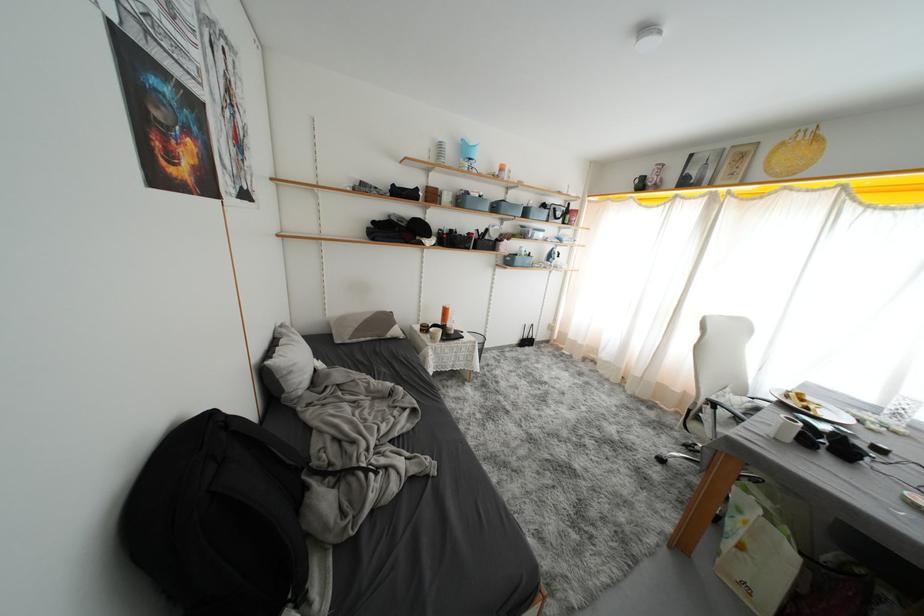
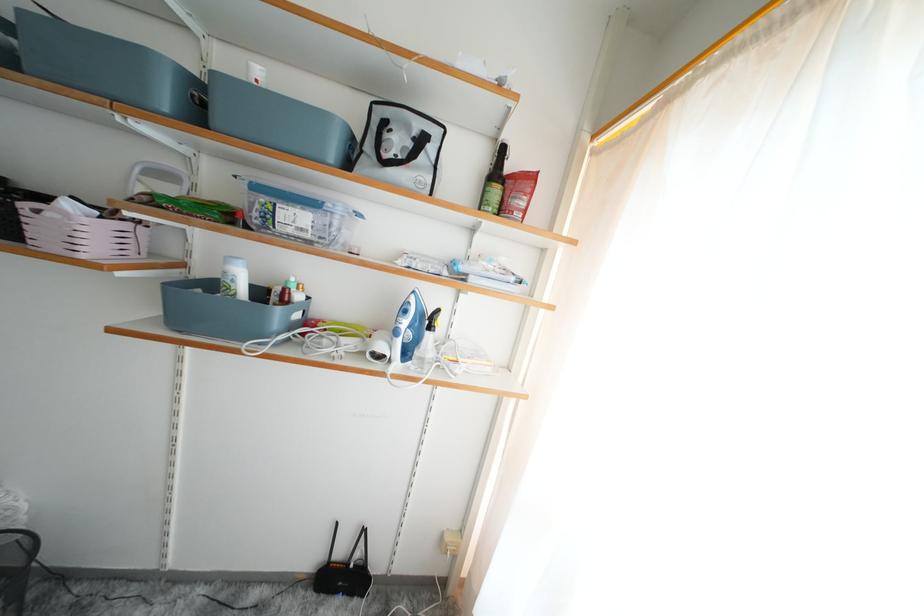
Which direction would the cameraman need to move to produce the second image?

The cameraman moved toward right, forward.